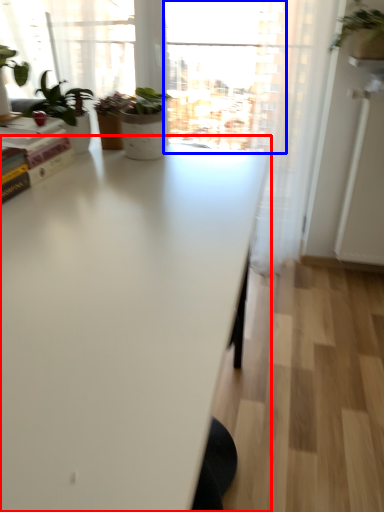
Question: Among these objects, which one is farthest to the camera, table (highlighted by a red box) or window (highlighted by a blue box)?

Choices:
 (A) table
 (B) window

Answer: (B)